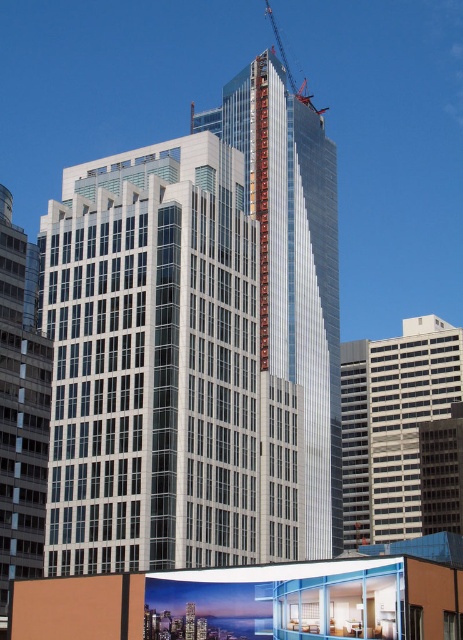
Is white glass building at center thinner than metallic construction crane at upper center?

No.

This screenshot has height=640, width=463. Identify the location of white glass building at center. (162, 369).

Can you confirm if sleek glass tower at center is positioned above silver glass building at left?

Correct, sleek glass tower at center is located above silver glass building at left.

Is point (313, 518) behind point (4, 458)?

That is True.

The height and width of the screenshot is (640, 463). Find the location of `sleek glass tower at center`. sleek glass tower at center is located at coordinates (294, 264).

At what (x,y) coordinates should I click in order to perform the action: click on sleek glass tower at center. Please return your answer as a coordinate pair (x, y). Looking at the image, I should click on (294, 264).

Image resolution: width=463 pixels, height=640 pixels. What do you see at coordinates (162, 369) in the screenshot? I see `white glass building at center` at bounding box center [162, 369].

Which is in front, point (171, 557) or point (436, 410)?

Point (171, 557)

Locate an element on the screen. The image size is (463, 640). white glass building at center is located at coordinates (162, 369).

You are a GUI agent. You are given a task and a screenshot of the screen. Output one action in this format:
    pyautogui.click(x=<x>, y=<y>)
    Task: Click on the white glass building at center
    
    Given the screenshot: What is the action you would take?
    pyautogui.click(x=162, y=369)